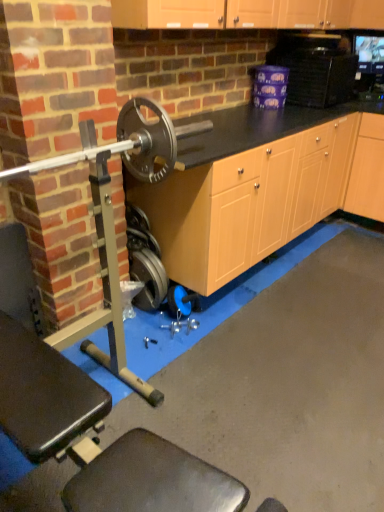
Question: Can you confirm if black plastic microwave at upper right is shorter than polished silver barbell at left?

Choices:
 (A) no
 (B) yes

Answer: (B)

Question: Does black plastic microwave at upper right have a larger size compared to polished silver barbell at left?

Choices:
 (A) yes
 (B) no

Answer: (B)

Question: Does black plastic microwave at upper right touch polished silver barbell at left?

Choices:
 (A) yes
 (B) no

Answer: (B)

Question: Is black plastic microwave at upper right positioned beyond the bounds of polished silver barbell at left?

Choices:
 (A) no
 (B) yes

Answer: (B)

Question: Are black plastic microwave at upper right and polished silver barbell at left far apart?

Choices:
 (A) no
 (B) yes

Answer: (B)

Question: Considering the positions of black plastic microwave at upper right and light wood cabinet at right in the image, is black plastic microwave at upper right wider or thinner than light wood cabinet at right?

Choices:
 (A) wide
 (B) thin

Answer: (B)

Question: From the image's perspective, is black plastic microwave at upper right above or below light wood cabinet at right?

Choices:
 (A) above
 (B) below

Answer: (A)

Question: Is point (327, 45) positioned closer to the camera than point (367, 177)?

Choices:
 (A) closer
 (B) farther

Answer: (A)

Question: Based on their sizes in the image, would you say black plastic microwave at upper right is bigger or smaller than light wood cabinet at right?

Choices:
 (A) small
 (B) big

Answer: (A)

Question: Is metallic silver weight at lower center in front of or behind polished silver barbell at left in the image?

Choices:
 (A) front
 (B) behind

Answer: (B)

Question: Is point (145, 256) positioned closer to the camera than point (28, 172)?

Choices:
 (A) closer
 (B) farther

Answer: (B)

Question: From a real-world perspective, relative to polished silver barbell at left, is metallic silver weight at lower center vertically above or below?

Choices:
 (A) above
 (B) below

Answer: (B)

Question: Is metallic silver weight at lower center inside or outside of polished silver barbell at left?

Choices:
 (A) outside
 (B) inside

Answer: (A)

Question: From their relative heights in the image, would you say polished silver barbell at left is taller or shorter than black plastic microwave at upper right?

Choices:
 (A) tall
 (B) short

Answer: (A)

Question: Relative to black plastic microwave at upper right, is polished silver barbell at left in front or behind?

Choices:
 (A) behind
 (B) front

Answer: (B)